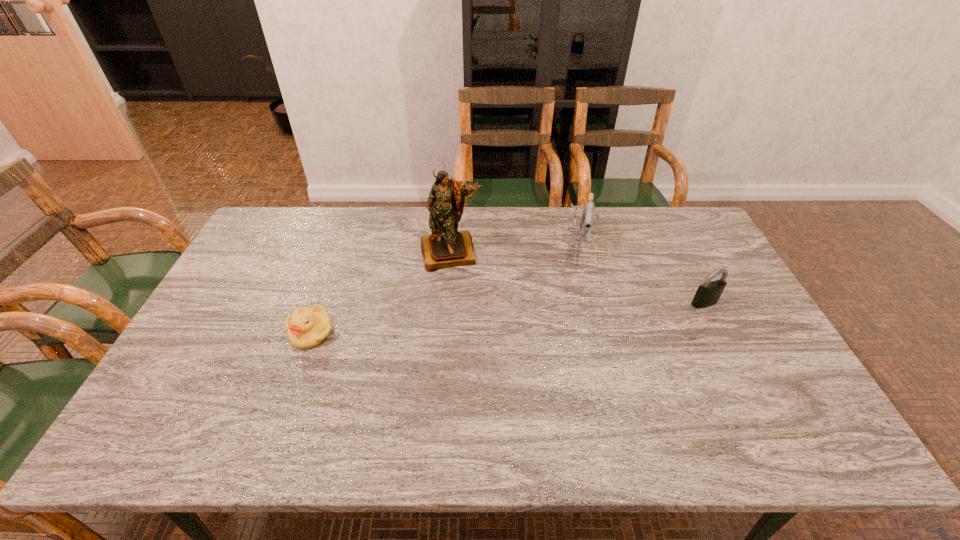
You are a GUI agent. You are given a task and a screenshot of the screen. Output one action in this format:
    pyautogui.click(x=<x>, y=<y>)
    Task: Click on the free spot located at the barrel end of the third shortest object
    This screenshot has width=960, height=540.
    Given the screenshot: What is the action you would take?
    pyautogui.click(x=570, y=350)

This screenshot has width=960, height=540. In order to click on vacant region located at the barrel end of the third shortest object in this screenshot , I will do `click(574, 310)`.

Find the location of a particular element. The width and height of the screenshot is (960, 540). vacant space situated at the barrel end of the third shortest object is located at coordinates (578, 276).

At what (x,y) coordinates should I click in order to perform the action: click on vacant space located on the front-facing side of the figurine. Please return your answer as a coordinate pair (x, y). Looking at the image, I should click on (456, 283).

Locate an element on the screen. The image size is (960, 540). blank space located on the front-facing side of the figurine is located at coordinates 458,296.

Find the location of a particular element. The height and width of the screenshot is (540, 960). free point located on the front-facing side of the figurine is located at coordinates (460, 306).

Image resolution: width=960 pixels, height=540 pixels. I want to click on gun located in the far edge section of the desktop, so click(x=587, y=218).

You are a GUI agent. You are given a task and a screenshot of the screen. Output one action in this format:
    pyautogui.click(x=<x>, y=<y>)
    Task: Click on the figurine positioned at the far edge
    
    Given the screenshot: What is the action you would take?
    pyautogui.click(x=446, y=247)

Find the location of a particular element. object that is positioned at the right edge is located at coordinates (707, 294).

Locate an element on the screen. Image resolution: width=960 pixels, height=540 pixels. vacant space at the far edge of the desktop is located at coordinates (627, 217).